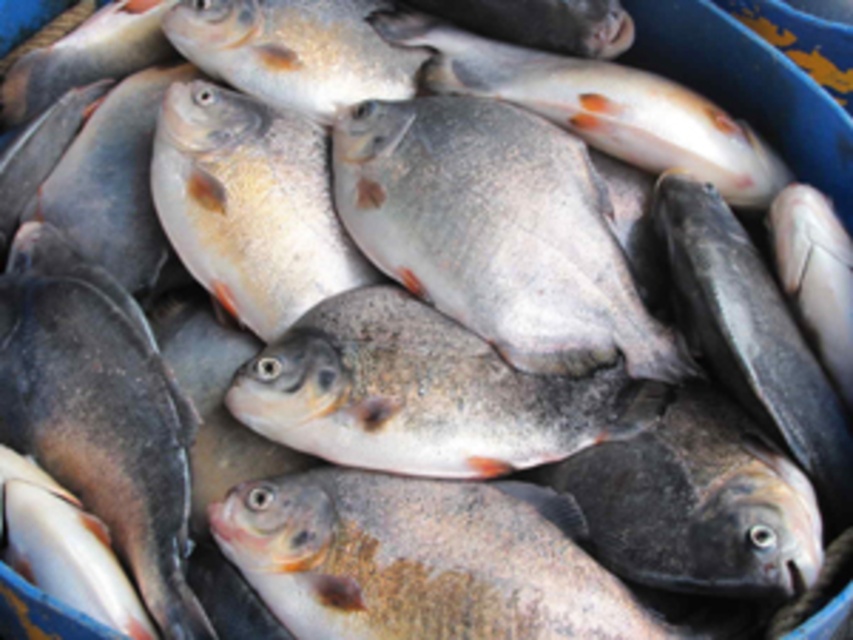
Question: Can you confirm if shiny silver fish at center is wider than gray matte fish at center?

Choices:
 (A) no
 (B) yes

Answer: (A)

Question: Which object appears farthest from the camera in this image?

Choices:
 (A) gray matte fish at center
 (B) shiny silver fish at center

Answer: (B)

Question: Does shiny silver fish at center have a lesser width compared to gray matte fish at center?

Choices:
 (A) no
 (B) yes

Answer: (B)

Question: Among these objects, which one is farthest from the camera?

Choices:
 (A) gray matte fish at center
 (B) shiny silver fish at center

Answer: (B)

Question: Does shiny silver fish at center have a greater width compared to gray matte fish at center?

Choices:
 (A) yes
 (B) no

Answer: (B)